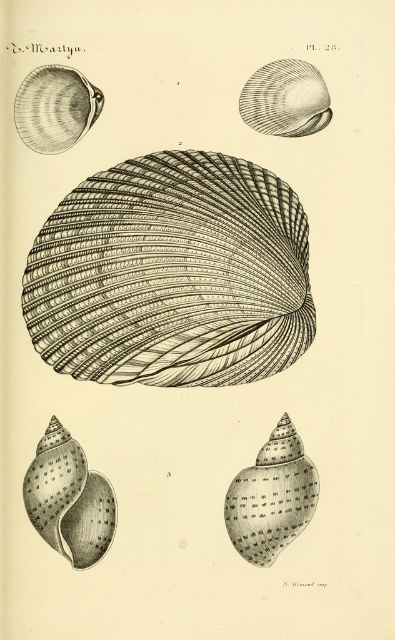
You are an assistant examining the image of seashells. The image has a central large shell labeled 2 and four smaller shells labeled 1, 3, 4, and 5. You notice a point at coordinates (69, 499). Which shell does this point correspond to?

The point at coordinates (69, 499) corresponds to the smooth gray shell at lower left.